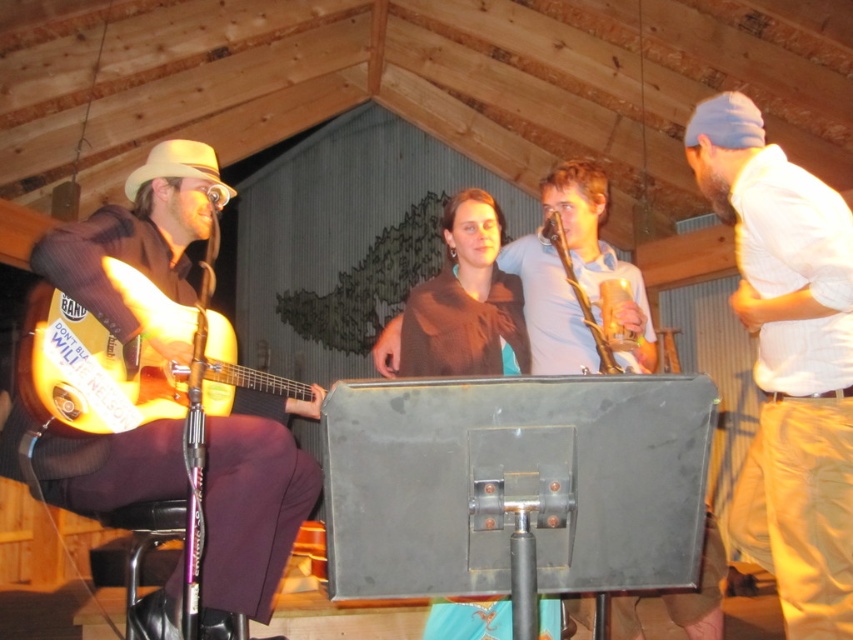
Question: Which point is closer to the camera taking this photo?

Choices:
 (A) (181, 192)
 (B) (207, 317)
 (C) (759, 205)

Answer: (C)

Question: Which of the following is the farthest from the observer?

Choices:
 (A) (828, 580)
 (B) (276, 385)
 (C) (157, 193)

Answer: (B)

Question: Does white cotton shirt at right have a lesser width compared to shiny orange electric guitar at left?

Choices:
 (A) no
 (B) yes

Answer: (B)

Question: Considering the real-world distances, which object is closest to the shiny orange electric guitar at left?

Choices:
 (A) white cotton shirt at right
 (B) matte brown guitar at left

Answer: (B)

Question: Can you confirm if matte brown guitar at left is bigger than shiny orange electric guitar at left?

Choices:
 (A) yes
 (B) no

Answer: (A)

Question: Is white cotton shirt at right to the left of shiny orange electric guitar at left from the viewer's perspective?

Choices:
 (A) yes
 (B) no

Answer: (B)